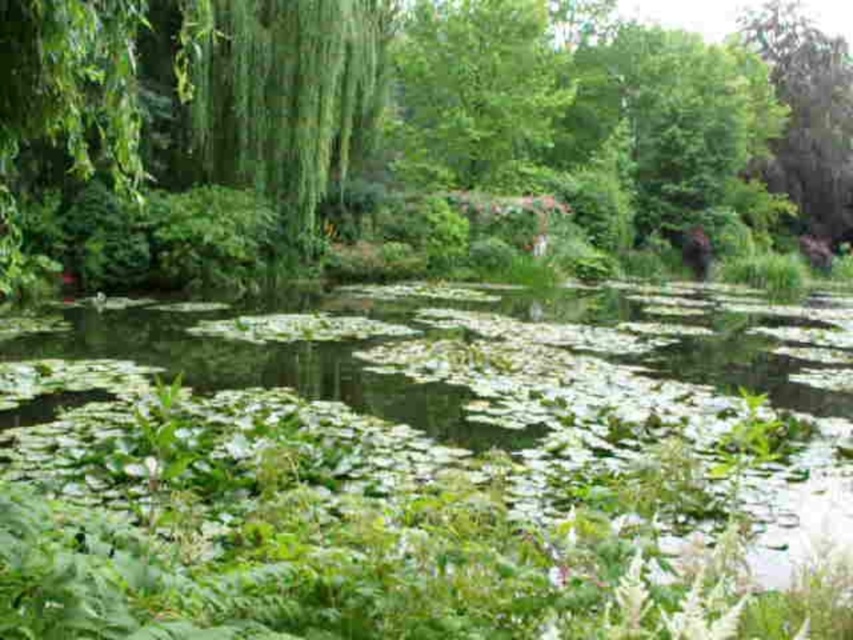
You are a bird flying over the pond and want to land on a spot that is taller. Between the green leafy water at center and the green leafy tree at upper right, which one should you choose?

The green leafy tree at upper right is taller than the green leafy water at center, so you should land on the green leafy tree at upper right.

You are standing at the edge of the pond and want to throw a pebble to hit both the green leafy water at center and the green leafy tree at upper right. Can you do it in one throw?

The green leafy water at center is 140.38 feet away from the green leafy tree at upper right, so the distance between them is too large to hit both in a single throw.